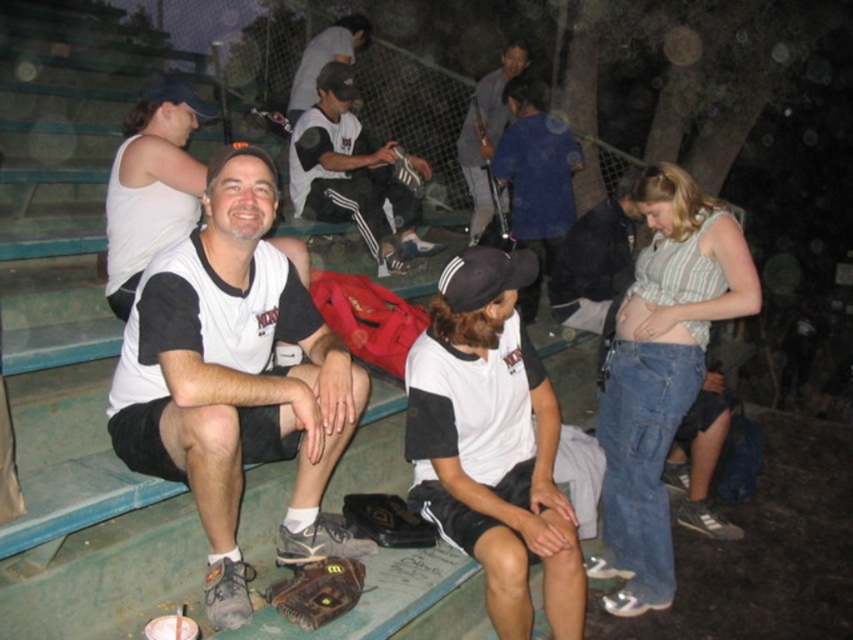
Can you confirm if white matte t-shirt at center is positioned to the right of white matte baseball cap at center?

Correct, you'll find white matte t-shirt at center to the right of white matte baseball cap at center.

Is point (189, 412) closer to camera compared to point (122, 308)?

Yes.

Does point (346, 440) come behind point (114, 227)?

No, it is not.

Identify the location of white matte t-shirt at center. (235, 380).

Is white matte shirt at center closer to camera compared to dark gray fabric jacket at center?

Yes, white matte shirt at center is in front of dark gray fabric jacket at center.

Does point (454, 451) come behind point (476, 225)?

No, it is in front of (476, 225).

Where is `white matte shirt at center`? white matte shirt at center is located at coordinates (492, 442).

How distant is white matte baseball cap at center from dark gray fabric jacket at center?

white matte baseball cap at center and dark gray fabric jacket at center are 3.19 meters apart.

Is white matte baseball cap at center thinner than dark gray fabric jacket at center?

Yes.

Between point (109, 180) and point (483, 221), which one is positioned in front?

Point (109, 180) is in front.

The height and width of the screenshot is (640, 853). Identify the location of white matte baseball cap at center. (151, 182).